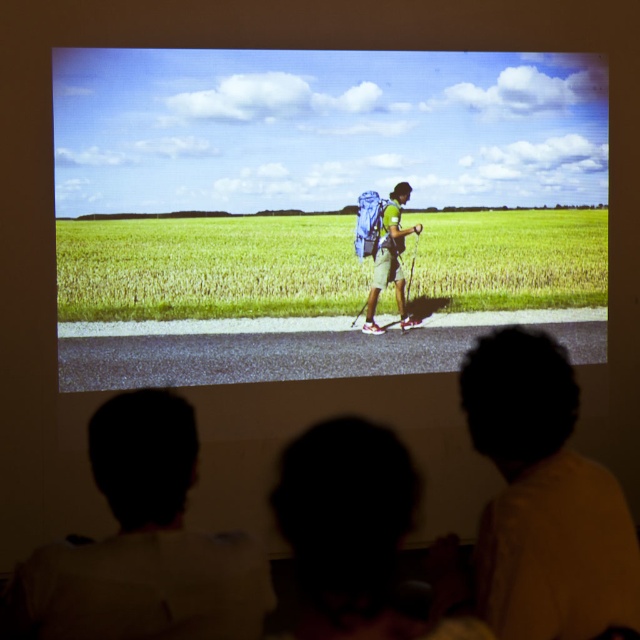
Question: Which object is the farthest from the matte yellow shirt at lower right?

Choices:
 (A) green fabric backpack at center
 (B) green grass at center
 (C) green matte backpack at center
 (D) silhouette hair at lower left

Answer: (D)

Question: Does matte yellow shirt at lower right have a lesser width compared to green matte backpack at center?

Choices:
 (A) yes
 (B) no

Answer: (B)

Question: Which object is farther from the camera taking this photo?

Choices:
 (A) green fabric backpack at center
 (B) matte yellow shirt at lower right
 (C) green grass at center

Answer: (C)

Question: Which point appears farthest from the camera in this image?

Choices:
 (A) (536, 332)
 (B) (513, 280)

Answer: (B)

Question: Can you confirm if green grass at center is positioned below green matte backpack at center?

Choices:
 (A) no
 (B) yes

Answer: (B)

Question: Is green fabric backpack at center further to the viewer compared to green grass at center?

Choices:
 (A) no
 (B) yes

Answer: (A)